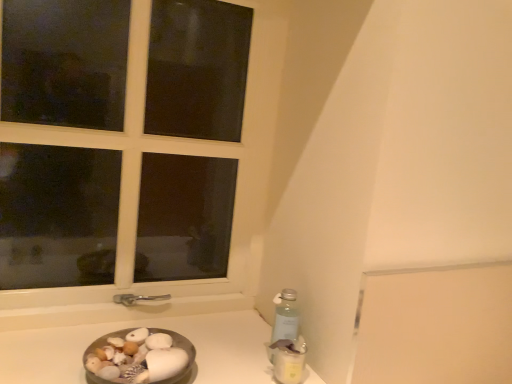
Where is `vacant space behind smooth white shells at lower left`? The width and height of the screenshot is (512, 384). vacant space behind smooth white shells at lower left is located at coordinates (205, 335).